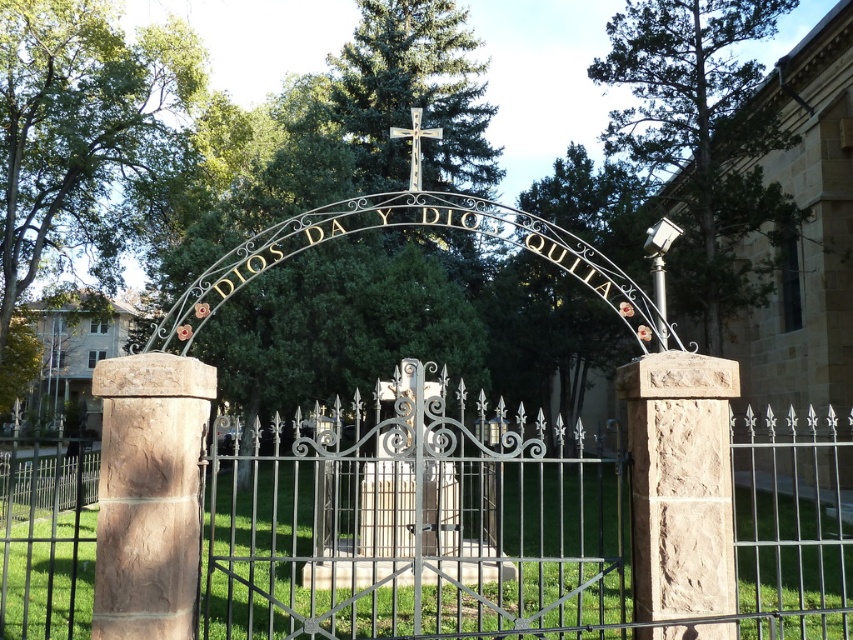
You are standing at the entrance of the cemetery and want to know the exact location of the black wrought iron fence at center. What are its coordinates?

The black wrought iron fence at center is located at point (x=412, y=522).

You are a visitor standing at the entrance of the cemetery. You want to take a photo of both the stone church at left and the metallic cross at center. Which object should you focus on first if you want to ensure both are fully visible in the frame?

You should focus on the stone church at left first because it is taller than the metallic cross at center, so you need to adjust the camera angle to include its full height while still capturing the metallic cross at center in the frame.

You are standing in front of the decorative metal archway at the cemetery entrance. There is a black wrought iron fence at center marked by point (x=412, y=522). Where is the black wrought iron fence located relative to the archway?

The black wrought iron fence at center marked by point (x=412, y=522) is located directly at the center of the archway entrance.